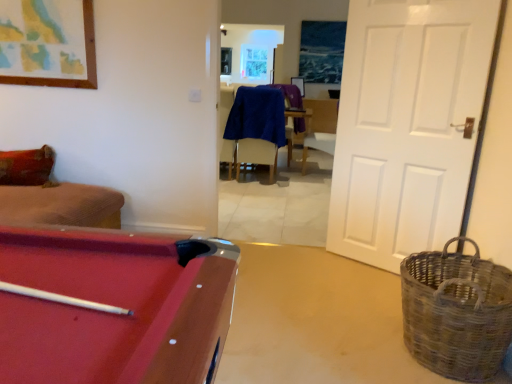
Question: From a real-world perspective, is blue fabric chair at center below blue fabric armchair at center?

Choices:
 (A) no
 (B) yes

Answer: (B)

Question: From the image's perspective, is blue fabric chair at center on top of blue fabric armchair at center?

Choices:
 (A) yes
 (B) no

Answer: (B)

Question: Is blue fabric chair at center smaller than blue fabric armchair at center?

Choices:
 (A) no
 (B) yes

Answer: (A)

Question: Considering the relative positions of blue fabric chair at center and blue fabric armchair at center in the image provided, is blue fabric chair at center to the left of blue fabric armchair at center from the viewer's perspective?

Choices:
 (A) yes
 (B) no

Answer: (A)

Question: Would you consider blue fabric chair at center to be distant from blue fabric armchair at center?

Choices:
 (A) yes
 (B) no

Answer: (B)

Question: From the image's perspective, is rubberized red pool table at lower left located above or below white matte door at right?

Choices:
 (A) above
 (B) below

Answer: (B)

Question: Considering the relative positions of rubberized red pool table at lower left and white matte door at right in the image provided, is rubberized red pool table at lower left to the left or to the right of white matte door at right?

Choices:
 (A) right
 (B) left

Answer: (B)

Question: From a real-world perspective, is rubberized red pool table at lower left positioned above or below white matte door at right?

Choices:
 (A) above
 (B) below

Answer: (B)

Question: Considering the positions of rubberized red pool table at lower left and white matte door at right in the image, is rubberized red pool table at lower left bigger or smaller than white matte door at right?

Choices:
 (A) big
 (B) small

Answer: (A)

Question: Is white matte door at right to the left or to the right of blue fabric armchair at center in the image?

Choices:
 (A) left
 (B) right

Answer: (B)

Question: In the image, is white matte door at right positioned in front of or behind blue fabric armchair at center?

Choices:
 (A) front
 (B) behind

Answer: (A)

Question: Would you say white matte door at right is inside or outside blue fabric armchair at center?

Choices:
 (A) outside
 (B) inside

Answer: (A)

Question: Looking at the image, does white matte door at right seem bigger or smaller compared to blue fabric armchair at center?

Choices:
 (A) big
 (B) small

Answer: (B)

Question: Based on their positions, is rustic woven basket at right located to the left or right of blue fabric armchair at center?

Choices:
 (A) left
 (B) right

Answer: (B)

Question: From a real-world perspective, is rustic woven basket at right physically located above or below blue fabric armchair at center?

Choices:
 (A) above
 (B) below

Answer: (B)